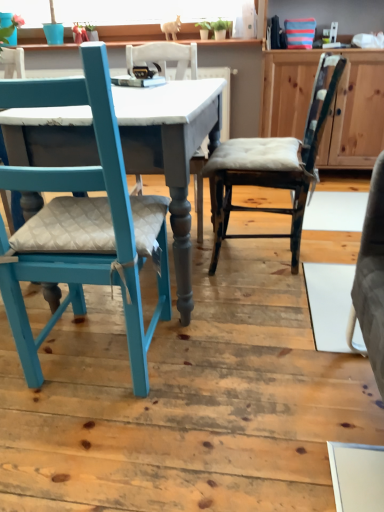
Question: Can you confirm if wooden cabinet at center is shorter than teal painted wood chair at left, marked as the 2th chair in a right-to-left arrangement?

Choices:
 (A) no
 (B) yes

Answer: (A)

Question: Can you confirm if wooden cabinet at center is wider than teal painted wood chair at left, acting as the 1th chair starting from the left?

Choices:
 (A) yes
 (B) no

Answer: (B)

Question: Considering the relative sizes of wooden cabinet at center and teal painted wood chair at left, acting as the 1th chair starting from the left, in the image provided, is wooden cabinet at center taller than teal painted wood chair at left, acting as the 1th chair starting from the left,?

Choices:
 (A) no
 (B) yes

Answer: (B)

Question: Is wooden cabinet at center outside of teal painted wood chair at left, marked as the 2th chair in a right-to-left arrangement?

Choices:
 (A) no
 (B) yes

Answer: (B)

Question: From a real-world perspective, is wooden cabinet at center on teal painted wood chair at left, marked as the 2th chair in a right-to-left arrangement?

Choices:
 (A) yes
 (B) no

Answer: (A)

Question: Is teal painted wood chair at left, acting as the 1th chair starting from the left, a part of wooden cabinet at center?

Choices:
 (A) no
 (B) yes

Answer: (A)

Question: Does wooden cabinet at center have a larger size compared to distressed wood chair at center, which appears as the first chair when viewed from the right?

Choices:
 (A) no
 (B) yes

Answer: (B)

Question: Is wooden cabinet at center further to camera compared to distressed wood chair at center, positioned as the second chair in left-to-right order?

Choices:
 (A) no
 (B) yes

Answer: (B)

Question: Is wooden cabinet at center taller than distressed wood chair at center, positioned as the second chair in left-to-right order?

Choices:
 (A) yes
 (B) no

Answer: (A)

Question: Is wooden cabinet at center thinner than distressed wood chair at center, which appears as the first chair when viewed from the right?

Choices:
 (A) no
 (B) yes

Answer: (B)

Question: Is the position of wooden cabinet at center less distant than that of distressed wood chair at center, which appears as the first chair when viewed from the right?

Choices:
 (A) no
 (B) yes

Answer: (A)

Question: Is wooden cabinet at center far from distressed wood chair at center, positioned as the second chair in left-to-right order?

Choices:
 (A) no
 (B) yes

Answer: (A)

Question: Considering the relative sizes of distressed wood chair at center, positioned as the second chair in left-to-right order, and matte gray table at center in the image provided, is distressed wood chair at center, positioned as the second chair in left-to-right order, smaller than matte gray table at center?

Choices:
 (A) no
 (B) yes

Answer: (B)